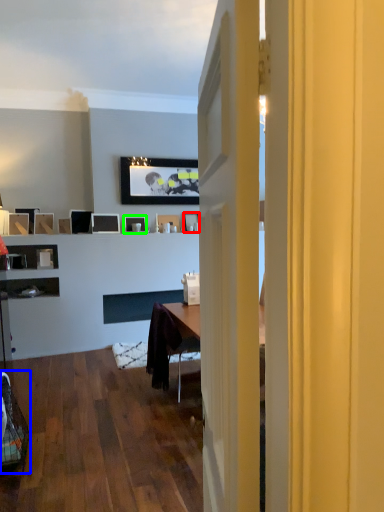
Question: Which object is positioned farthest from picture frame (highlighted by a red box)? Select from swivel chair (highlighted by a blue box) and picture frame (highlighted by a green box).

Choices:
 (A) swivel chair
 (B) picture frame

Answer: (A)